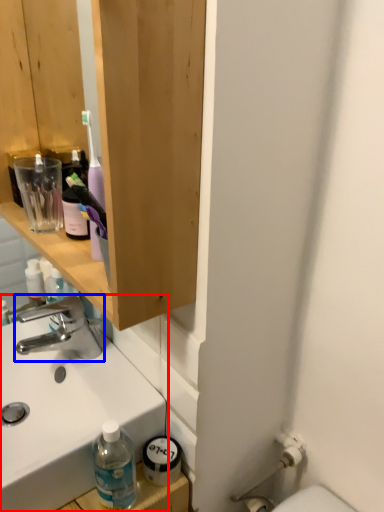
Question: Among these objects, which one is nearest to the camera, sink (highlighted by a red box) or tap (highlighted by a blue box)?

Choices:
 (A) sink
 (B) tap

Answer: (A)